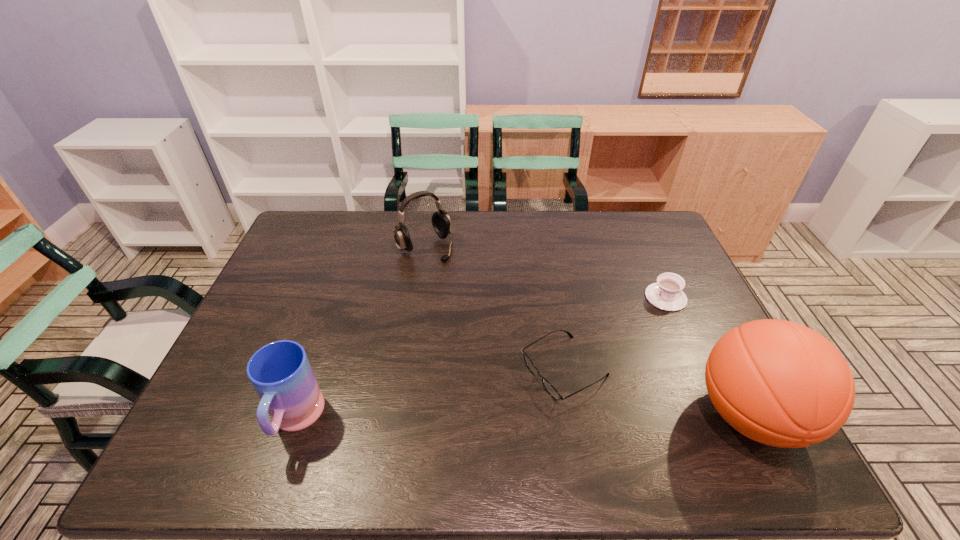
You are a GUI agent. You are given a task and a screenshot of the screen. Output one action in this format:
    pyautogui.click(x=<x>, y=<y>)
    Task: Click on the mug
    This screenshot has width=960, height=540.
    Given the screenshot: What is the action you would take?
    click(x=280, y=372)

The image size is (960, 540). In order to click on the tallest object in this screenshot , I will do `click(779, 383)`.

At what (x,y) coordinates should I click in order to perform the action: click on the shortest object. Please return your answer as a coordinate pair (x, y). The image size is (960, 540). Looking at the image, I should click on (549, 388).

Identify the location of spectacles. (549, 388).

The image size is (960, 540). I want to click on the fourth nearest object, so click(x=666, y=294).

The height and width of the screenshot is (540, 960). Find the location of `teacup`. teacup is located at coordinates (666, 294).

Find the location of a particular element. Image resolution: width=960 pixels, height=540 pixels. headset is located at coordinates (441, 222).

This screenshot has height=540, width=960. What are the coordinates of `the fourth object from right to left` in the screenshot? It's located at (441, 222).

Locate an element on the screen. The image size is (960, 540). vacant region located on the back of the tallest object is located at coordinates (705, 325).

Identify the location of free space located on the front-facing side of the shortest object. (491, 409).